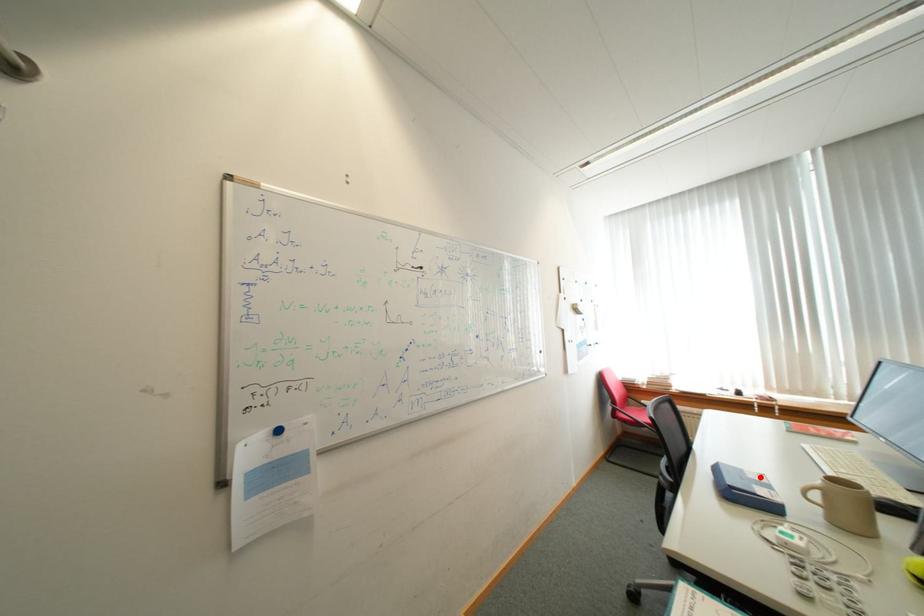
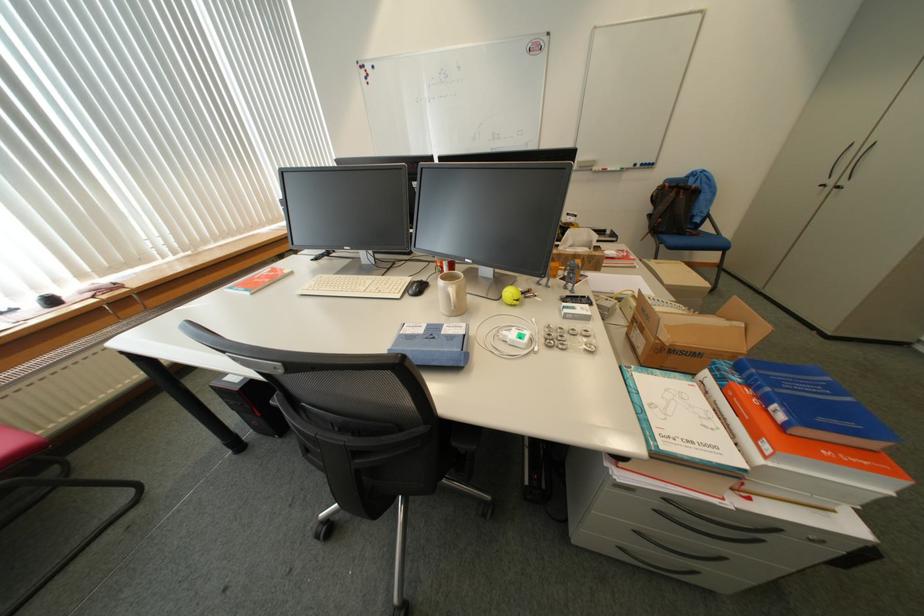
Where in the second image is the point corresponding to the highlighted location from the first image?

(430, 331)